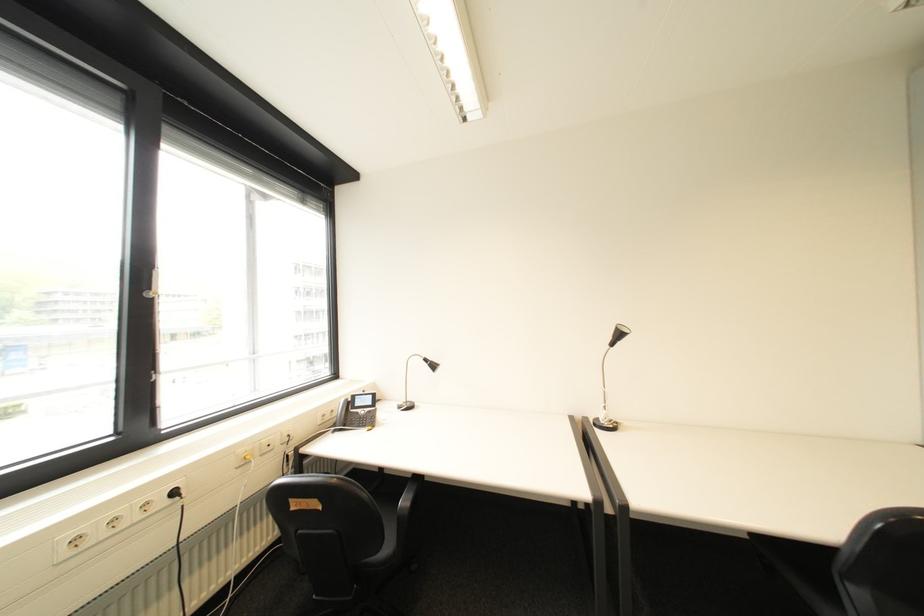
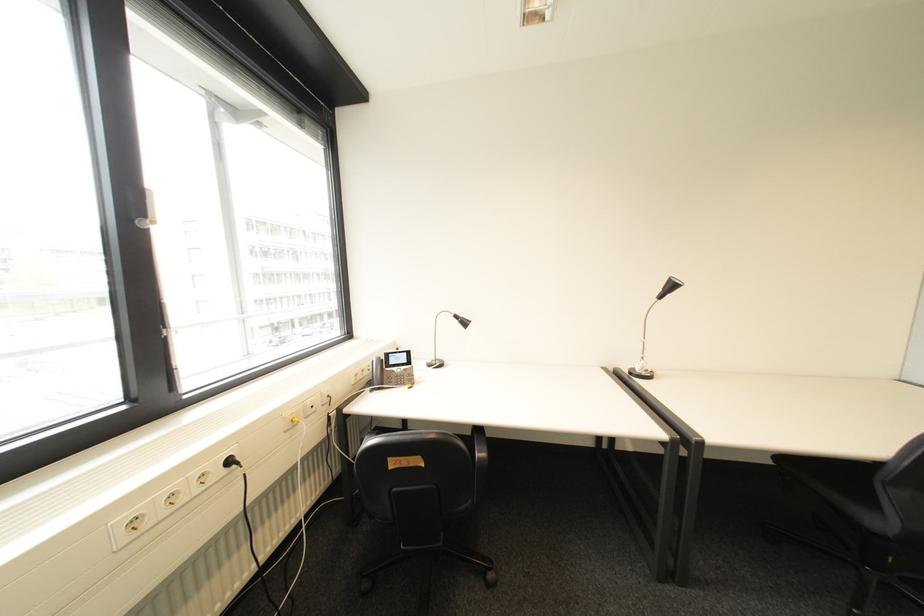
Find the pixel in the second image that matches point (361, 411) in the first image.

(396, 370)